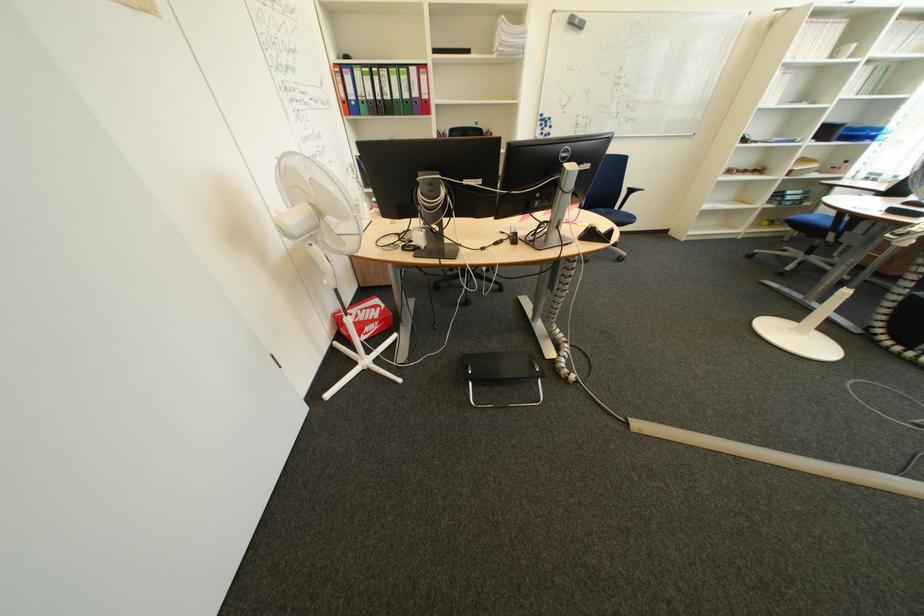
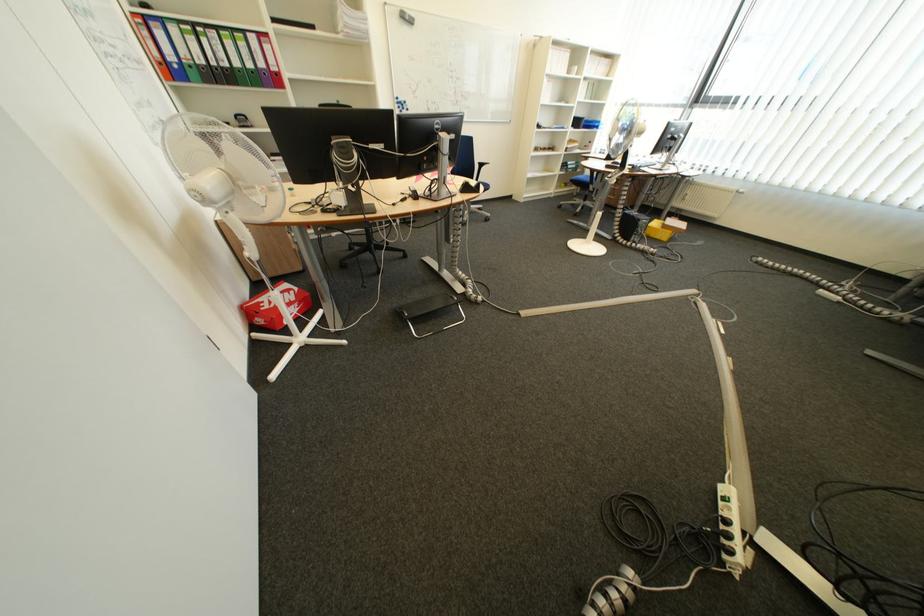
Locate, in the second image, the point that corresponds to point 483,373 in the first image.

(419, 315)